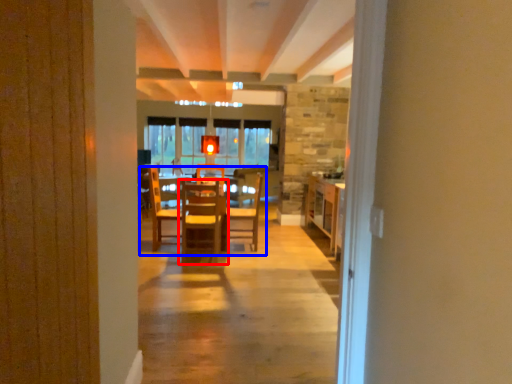
Question: Which of the following is the closest to the observer, chair (highlighted by a red box) or table (highlighted by a blue box)?

Choices:
 (A) chair
 (B) table

Answer: (A)